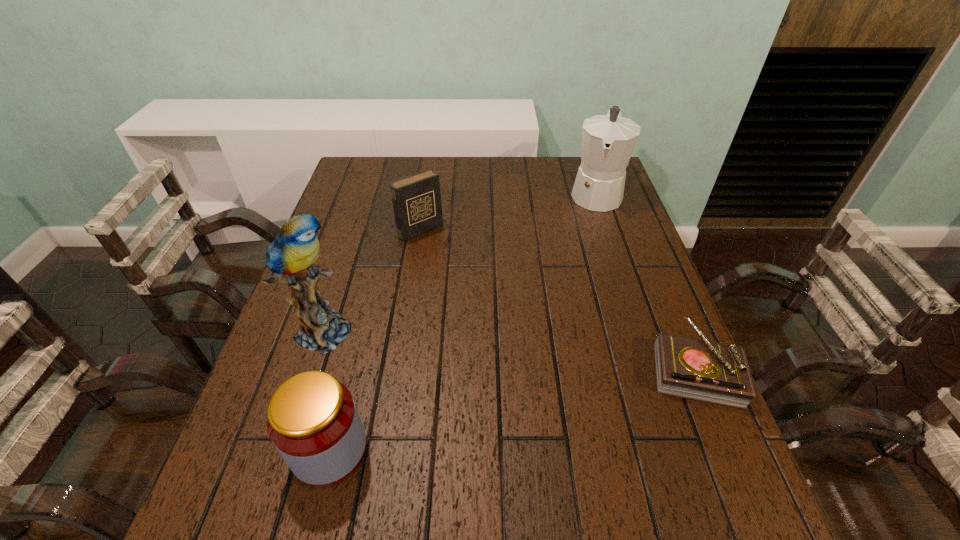
Find the location of a particular element. The image size is (960, 540). object at the near edge is located at coordinates (313, 421).

Locate an element on the screen. The width and height of the screenshot is (960, 540). jar that is at the left edge is located at coordinates pos(313,421).

Locate an element on the screen. The height and width of the screenshot is (540, 960). parrot that is at the left edge is located at coordinates (290, 257).

Locate an element on the screen. diary located at the right edge is located at coordinates (701, 370).

Locate an element on the screen. The image size is (960, 540). coffeepot present at the right edge is located at coordinates (608, 141).

Find the location of a particular element. This screenshot has width=960, height=540. object present at the near left corner is located at coordinates (313, 421).

The image size is (960, 540). I want to click on object located in the far right corner section of the desktop, so click(608, 141).

In the image, there is a desktop. Where is `vacant space at the far edge`? vacant space at the far edge is located at coordinates (528, 183).

This screenshot has height=540, width=960. I want to click on blank space at the near edge, so click(x=499, y=434).

The image size is (960, 540). Find the location of `blank area at the left edge`. blank area at the left edge is located at coordinates (270, 386).